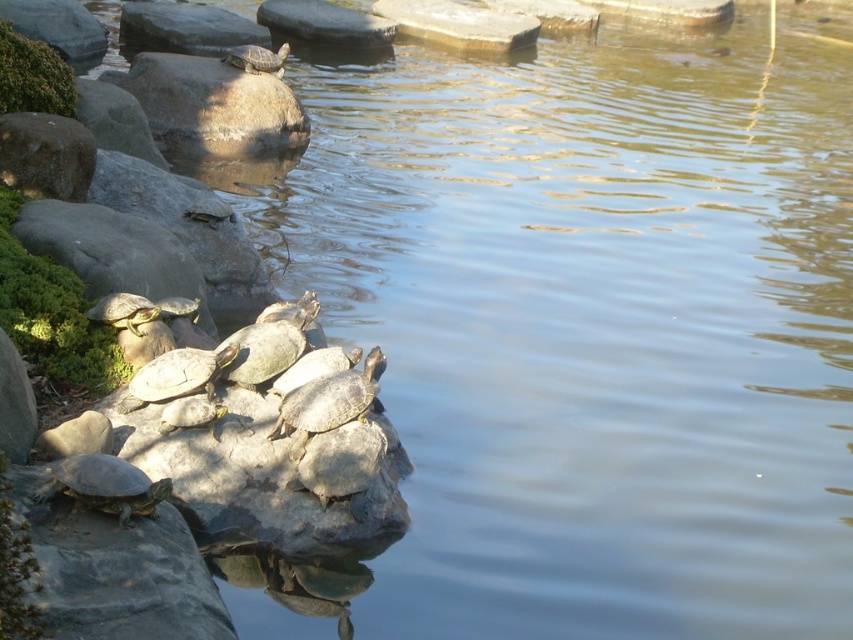
Is shiny brown tortoise at center shorter than shiny green tortoise at center left?

No.

Is point (283, 403) positioned in front of point (146, 301)?

Yes.

Between point (322, 397) and point (144, 316), which one is positioned in front?

Point (322, 397) is more forward.

You are a GUI agent. You are given a task and a screenshot of the screen. Output one action in this format:
    pyautogui.click(x=<x>, y=<y>)
    Task: Click on the shiny brown tortoise at center
    Image resolution: width=853 pixels, height=640 pixels.
    Given the screenshot: What is the action you would take?
    [x=328, y=401]

Can you confirm if shiny brown tortoise at lower left is positioned above smooth gray tortoise at center?

Incorrect, shiny brown tortoise at lower left is not positioned above smooth gray tortoise at center.

Image resolution: width=853 pixels, height=640 pixels. What do you see at coordinates (103, 484) in the screenshot? I see `shiny brown tortoise at lower left` at bounding box center [103, 484].

Who is more distant from viewer, (80, 493) or (149, 372)?

The point (149, 372) is more distant.

You are a GUI agent. You are given a task and a screenshot of the screen. Output one action in this format:
    pyautogui.click(x=<x>, y=<y>)
    Task: Click on the shiny brown tortoise at lower left
    Image resolution: width=853 pixels, height=640 pixels.
    Given the screenshot: What is the action you would take?
    pyautogui.click(x=103, y=484)

Based on the photo, does brown rough rock at upper center lie in front of shiny brown tortoise at lower left?

No, it is behind shiny brown tortoise at lower left.

Identify the location of brown rough rock at upper center. This screenshot has width=853, height=640. (x=213, y=106).

Between point (167, 52) and point (48, 484), which one is positioned behind?

The point (167, 52) is more distant.

The height and width of the screenshot is (640, 853). I want to click on brown rough rock at upper center, so click(213, 106).